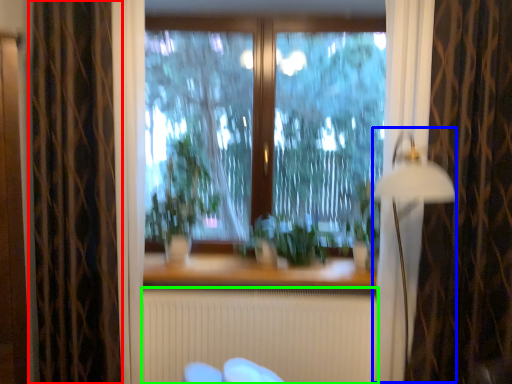
Question: Based on their relative distances, which object is farther from curtain (highlighted by a red box)? Choose from lamp (highlighted by a blue box) and radiator (highlighted by a green box).

Choices:
 (A) lamp
 (B) radiator

Answer: (A)